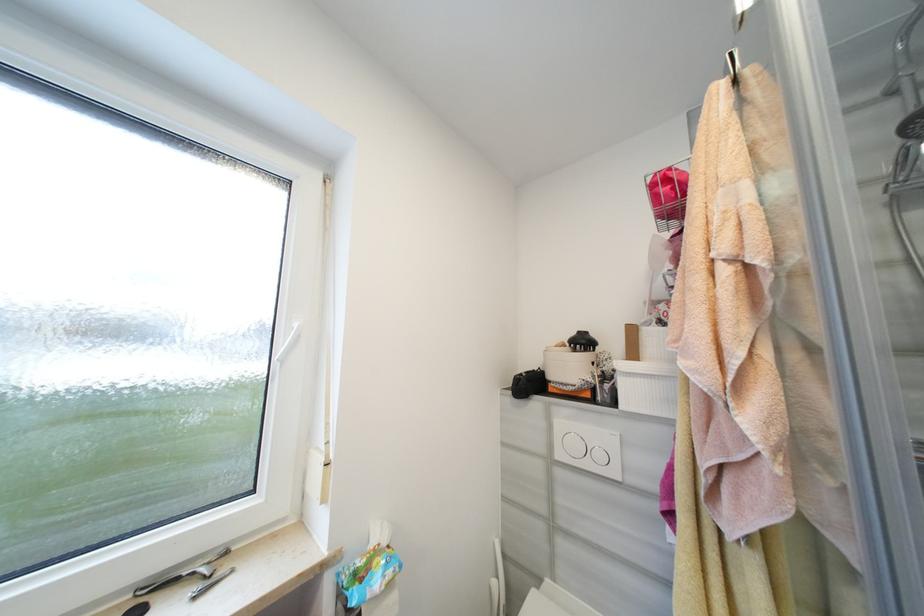
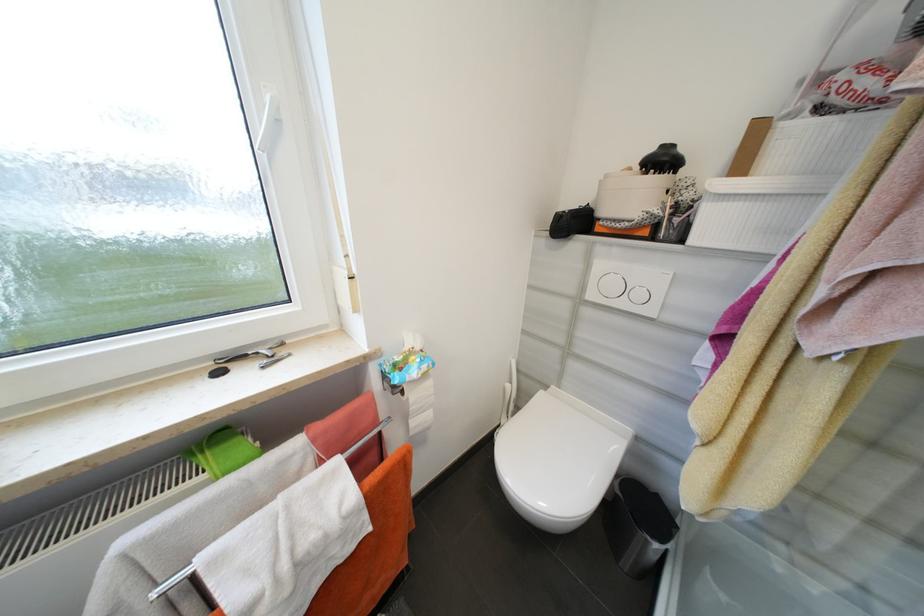
Where in the second image is the point corresponding to pixel 200 575 from the first image?

(262, 354)